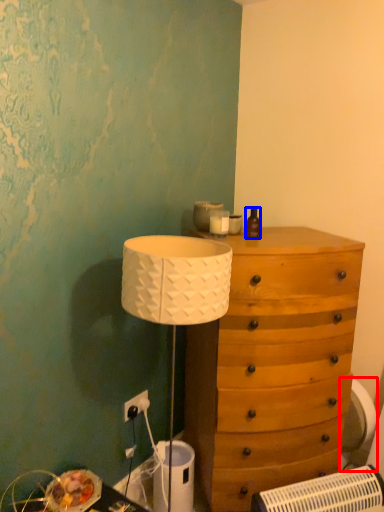
Question: Which point is closer to the camera, swivel chair (highlighted by a red box) or bottle (highlighted by a blue box)?

Choices:
 (A) swivel chair
 (B) bottle

Answer: (B)